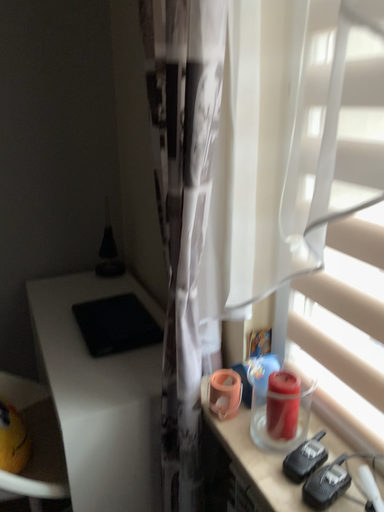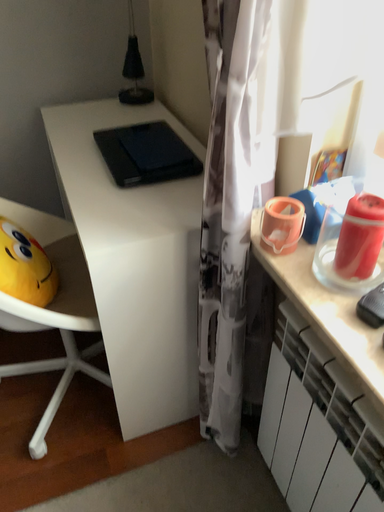
Question: Which way did the camera rotate in the video?

Choices:
 (A) rotated upward
 (B) rotated downward

Answer: (B)